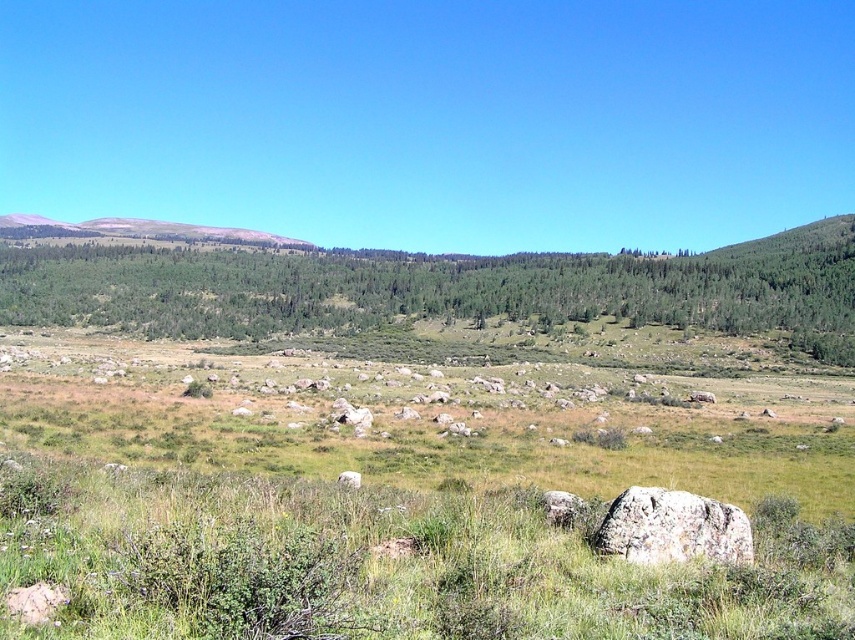
Can you confirm if smooth gray mountain at upper left is shorter than gray rough stone at center?

In fact, smooth gray mountain at upper left may be taller than gray rough stone at center.

Which is more to the right, smooth gray mountain at upper left or gray rough stone at center?

gray rough stone at center

Between point (140, 234) and point (351, 480), which one is positioned behind?

Point (140, 234)

At what (x,y) coordinates should I click in order to perform the action: click on smooth gray mountain at upper left. Please return your answer as a coordinate pair (x, y). The height and width of the screenshot is (640, 855). Looking at the image, I should click on (143, 230).

Is gray rough boulder at lower right to the right of gray rough stone at center from the viewer's perspective?

Indeed, gray rough boulder at lower right is positioned on the right side of gray rough stone at center.

Is gray rough boulder at lower right above gray rough stone at center?

Indeed, gray rough boulder at lower right is positioned over gray rough stone at center.

Measure the distance between point (665, 529) and camera.

Point (665, 529) and camera are 51.11 feet apart from each other.

What are the coordinates of `gray rough boulder at lower right` in the screenshot? It's located at (671, 528).

Is gray rough boulder at lower right positioned at the back of smooth gray mountain at upper left?

No, it is in front of smooth gray mountain at upper left.

Between gray rough boulder at lower right and smooth gray mountain at upper left, which one is positioned lower?

gray rough boulder at lower right is below.

Between point (733, 512) and point (10, 221), which one is positioned in front?

Point (733, 512) is in front.

At what (x,y) coordinates should I click in order to perform the action: click on gray rough boulder at lower right. Please return your answer as a coordinate pair (x, y). This screenshot has height=640, width=855. Looking at the image, I should click on (671, 528).